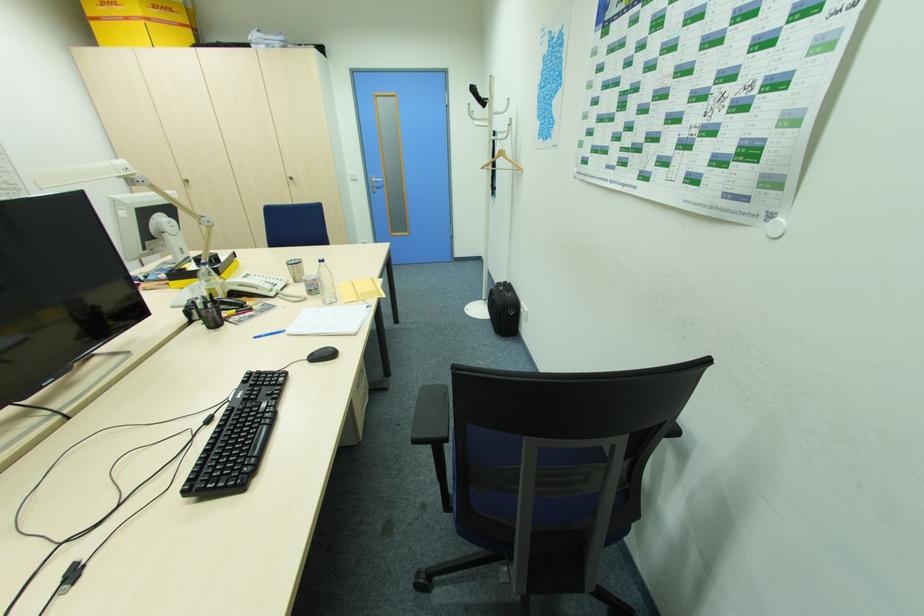
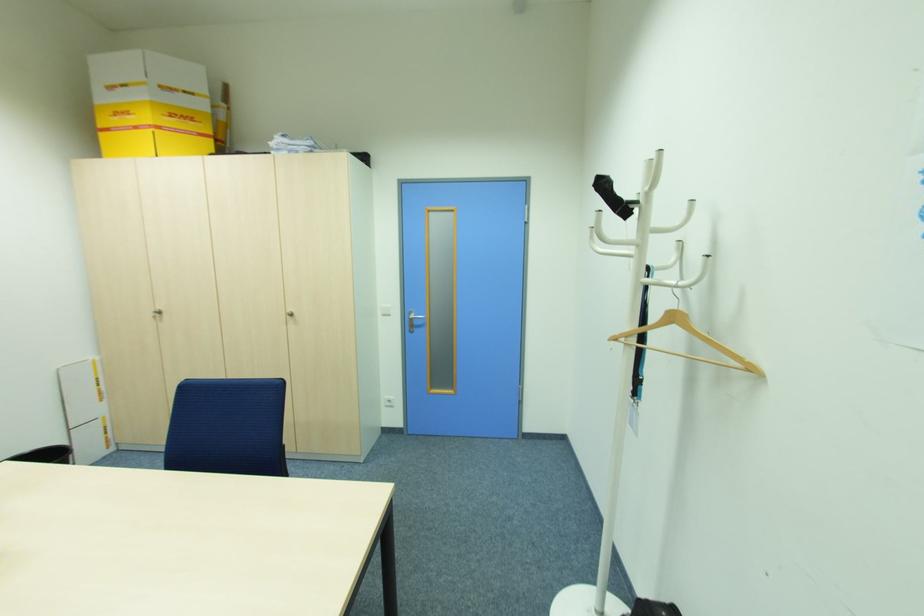
Locate, in the second image, the point that corresponds to point 189,180 in the first image.

(162, 312)